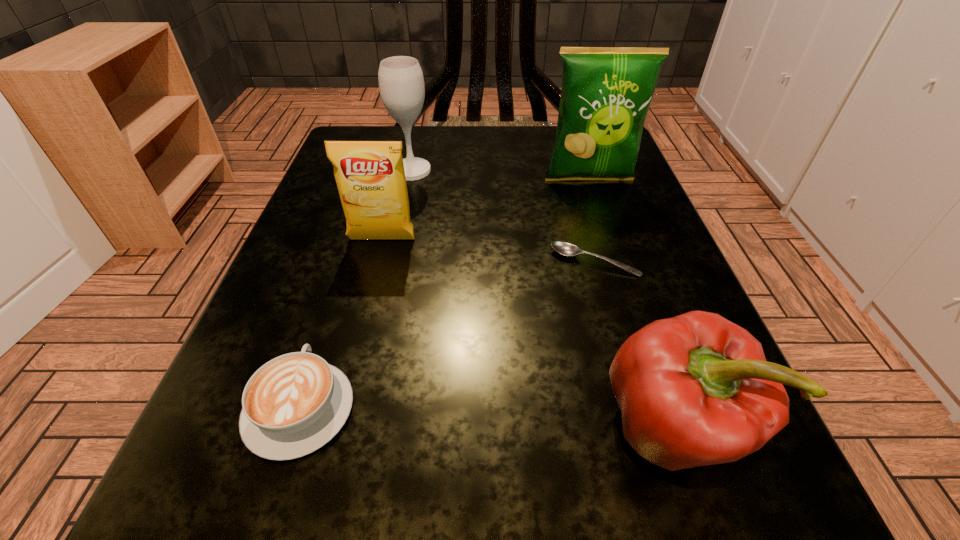
Find the location of a particular element. This screenshot has width=960, height=540. vacant area between the wineglass and the fifth tallest object is located at coordinates (356, 289).

Find the location of a particular element. This screenshot has width=960, height=540. free spot between the cappuccino and the nearer crisp (potato chip) is located at coordinates (341, 323).

Where is `vacant area between the shorter crisp (potato chip) and the taller crisp (potato chip)`? The image size is (960, 540). vacant area between the shorter crisp (potato chip) and the taller crisp (potato chip) is located at coordinates (486, 210).

Locate an element on the screen. This screenshot has width=960, height=540. the second closest object relative to the wineglass is located at coordinates (606, 92).

This screenshot has height=540, width=960. What are the coordinates of `object that can be found as the closest to the shortest object` in the screenshot? It's located at (694, 390).

This screenshot has width=960, height=540. What are the coordinates of `free space that satisfies the following two spatial constraints: 1. on the side of the fifth tallest object with the handle; 2. on the right side of the soupspoon` in the screenshot? It's located at (347, 261).